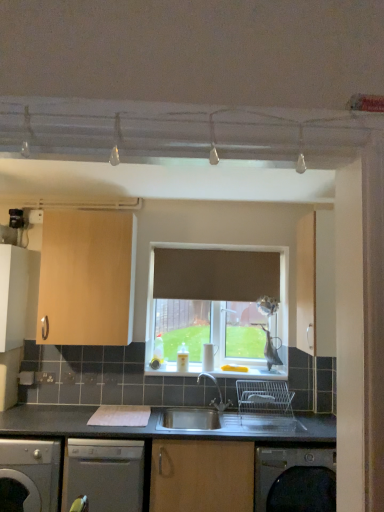
You are a GUI agent. You are given a task and a screenshot of the screen. Output one action in this format:
    pyautogui.click(x=<x>, y=<y>)
    Task: Click on the satin silver dishwasher at lower center, the second dishwasher viewed from the left
    The width and height of the screenshot is (384, 512).
    Given the screenshot: What is the action you would take?
    tap(104, 474)

You are a GUI agent. You are given a task and a screenshot of the screen. Output one action in this format:
    pyautogui.click(x=<x>, y=<y>)
    Task: Click on the stainless steel sink at center
    
    Given the screenshot: What is the action you would take?
    pyautogui.click(x=239, y=411)

What do you see at coordinates (239, 411) in the screenshot? I see `stainless steel sink at center` at bounding box center [239, 411].

Measure the distance between matte wood cabinet at right, the 1th cabinetry positioned from the right, and camera.

A distance of 7.50 feet exists between matte wood cabinet at right, the 1th cabinetry positioned from the right, and camera.

Where is `white glossy window sill at center`? The image size is (384, 512). white glossy window sill at center is located at coordinates coord(252,372).

The width and height of the screenshot is (384, 512). Find the location of `satin silver dishwasher at lower center, the second dishwasher viewed from the left`. satin silver dishwasher at lower center, the second dishwasher viewed from the left is located at coordinates (104, 474).

From the image's perspective, would you say stainless steel sink at center is positioned over white glossy window sill at center?

No, from the image's perspective, stainless steel sink at center is not above white glossy window sill at center.

From a real-world perspective, is stainless steel sink at center physically located above or below white glossy window sill at center?

From a real-world perspective, stainless steel sink at center is physically below white glossy window sill at center.

Locate an element on the screen. The height and width of the screenshot is (512, 384). sink below the white glossy window sill at center (from the image's perspective) is located at coordinates (239, 411).

Is stainless steel sink at center oriented towards white glossy window sill at center?

No, stainless steel sink at center is not aimed at white glossy window sill at center.

Is white matte cabinet at left, which appears as the 1th cabinetry when viewed from the left, oriented away from matte wood cabinet at right, arranged as the third cabinetry when viewed from the left?

No, white matte cabinet at left, which appears as the 1th cabinetry when viewed from the left,'s orientation is not away from matte wood cabinet at right, arranged as the third cabinetry when viewed from the left.

Looking at this image, which object is wider, white matte cabinet at left, which appears as the 1th cabinetry when viewed from the left, or matte wood cabinet at right, the 1th cabinetry positioned from the right?

With larger width is matte wood cabinet at right, the 1th cabinetry positioned from the right.

Which is in front, white matte cabinet at left, marked as the third cabinetry in a right-to-left arrangement, or matte wood cabinet at right, arranged as the third cabinetry when viewed from the left?

matte wood cabinet at right, arranged as the third cabinetry when viewed from the left, is more forward.

In terms of height, does white matte cabinet at left, marked as the third cabinetry in a right-to-left arrangement, look taller or shorter compared to matte wood cabinet at right, arranged as the third cabinetry when viewed from the left?

Clearly, white matte cabinet at left, marked as the third cabinetry in a right-to-left arrangement, is shorter compared to matte wood cabinet at right, arranged as the third cabinetry when viewed from the left.

Which is behind, matte wood cabinet at right, arranged as the third cabinetry when viewed from the left, or white matte cabinet at left, marked as the third cabinetry in a right-to-left arrangement?

white matte cabinet at left, marked as the third cabinetry in a right-to-left arrangement, is behind.

From the image's perspective, is matte wood cabinet at right, arranged as the third cabinetry when viewed from the left, beneath white matte cabinet at left, which appears as the 1th cabinetry when viewed from the left?

No, from the image's perspective, matte wood cabinet at right, arranged as the third cabinetry when viewed from the left, is not below white matte cabinet at left, which appears as the 1th cabinetry when viewed from the left.

Between matte wood cabinet at right, the 1th cabinetry positioned from the right, and white matte cabinet at left, marked as the third cabinetry in a right-to-left arrangement, which one has smaller size?

white matte cabinet at left, marked as the third cabinetry in a right-to-left arrangement.

Is matte wood cabinet at right, the 1th cabinetry positioned from the right, looking in the opposite direction of white matte cabinet at left, marked as the third cabinetry in a right-to-left arrangement?

Result: matte wood cabinet at right, the 1th cabinetry positioned from the right, does not have its back to white matte cabinet at left, marked as the third cabinetry in a right-to-left arrangement.

Between white matte cabinet at left, marked as the third cabinetry in a right-to-left arrangement, and satin silver dishwasher at lower center, acting as the first dishwasher starting from the right, which one has smaller width?

With smaller width is white matte cabinet at left, marked as the third cabinetry in a right-to-left arrangement.

How far apart are white matte cabinet at left, marked as the third cabinetry in a right-to-left arrangement, and satin silver dishwasher at lower center, the second dishwasher viewed from the left?

white matte cabinet at left, marked as the third cabinetry in a right-to-left arrangement, and satin silver dishwasher at lower center, the second dishwasher viewed from the left, are 3.48 feet apart.

From the image's perspective, which cabinetry is the 1st one above the satin silver dishwasher at lower center, acting as the first dishwasher starting from the right? Please provide its 2D coordinates.

[(13, 295)]

From a real-world perspective, is white matte cabinet at left, which appears as the 1th cabinetry when viewed from the left, located beneath satin silver dishwasher at lower center, the second dishwasher viewed from the left?

Actually, white matte cabinet at left, which appears as the 1th cabinetry when viewed from the left, is physically above satin silver dishwasher at lower center, the second dishwasher viewed from the left, in the real world.

Which is more to the left, stainless steel sink at center or white matte cabinet at left, marked as the third cabinetry in a right-to-left arrangement?

white matte cabinet at left, marked as the third cabinetry in a right-to-left arrangement.

Is stainless steel sink at center wider than white matte cabinet at left, marked as the third cabinetry in a right-to-left arrangement?

Yes, stainless steel sink at center is wider than white matte cabinet at left, marked as the third cabinetry in a right-to-left arrangement.

Is there a large distance between stainless steel sink at center and white matte cabinet at left, marked as the third cabinetry in a right-to-left arrangement?

stainless steel sink at center is far away from white matte cabinet at left, marked as the third cabinetry in a right-to-left arrangement.

From the image's perspective, is satin silver dishwasher at lower left, the first dishwasher viewed from the left, beneath white matte cabinet at left, marked as the third cabinetry in a right-to-left arrangement?

Indeed, from the image's perspective, satin silver dishwasher at lower left, the first dishwasher viewed from the left, is shown beneath white matte cabinet at left, marked as the third cabinetry in a right-to-left arrangement.

Considering the sizes of objects satin silver dishwasher at lower left, the first dishwasher viewed from the left, and white matte cabinet at left, which appears as the 1th cabinetry when viewed from the left, in the image provided, who is smaller, satin silver dishwasher at lower left, the first dishwasher viewed from the left, or white matte cabinet at left, which appears as the 1th cabinetry when viewed from the left,?

white matte cabinet at left, which appears as the 1th cabinetry when viewed from the left.

Is the position of satin silver dishwasher at lower left, the 2th dishwasher in the right-to-left sequence, more distant than that of white matte cabinet at left, which appears as the 1th cabinetry when viewed from the left?

No, satin silver dishwasher at lower left, the 2th dishwasher in the right-to-left sequence, is in front of white matte cabinet at left, which appears as the 1th cabinetry when viewed from the left.

In the scene shown: Considering the positions of objects satin silver dishwasher at lower center, acting as the first dishwasher starting from the right, and stainless steel sink at center in the image provided, who is in front, satin silver dishwasher at lower center, acting as the first dishwasher starting from the right, or stainless steel sink at center?

satin silver dishwasher at lower center, acting as the first dishwasher starting from the right, is more forward.

Is stainless steel sink at center located within satin silver dishwasher at lower center, acting as the first dishwasher starting from the right?

No, satin silver dishwasher at lower center, acting as the first dishwasher starting from the right, does not contain stainless steel sink at center.

Can you confirm if satin silver dishwasher at lower center, the second dishwasher viewed from the left, is thinner than stainless steel sink at center?

In fact, satin silver dishwasher at lower center, the second dishwasher viewed from the left, might be wider than stainless steel sink at center.

You are a GUI agent. You are given a task and a screenshot of the screen. Output one action in this format:
    pyautogui.click(x=<x>, y=<y>)
    Task: Click on the sink that appears below the white glossy window sill at center (from a real-world perspective)
    Image resolution: width=384 pixels, height=512 pixels.
    Given the screenshot: What is the action you would take?
    pyautogui.click(x=239, y=411)

The height and width of the screenshot is (512, 384). I want to click on cabinetry located below the matte wood cabinet at right, the 1th cabinetry positioned from the right (from the image's perspective), so click(13, 295).

From the image, which object appears to be farther from satin silver dishwasher at lower left, the 2th dishwasher in the right-to-left sequence, satin silver dishwasher at lower center, the second dishwasher viewed from the left, or white matte cabinet at left, marked as the third cabinetry in a right-to-left arrangement?

Based on the image, white matte cabinet at left, marked as the third cabinetry in a right-to-left arrangement, appears to be further to satin silver dishwasher at lower left, the 2th dishwasher in the right-to-left sequence.

Which object lies nearer to the anchor point satin silver dishwasher at lower center, acting as the first dishwasher starting from the right, white matte cabinet at left, marked as the third cabinetry in a right-to-left arrangement, or stainless steel sink at center?

Based on the image, stainless steel sink at center appears to be nearer to satin silver dishwasher at lower center, acting as the first dishwasher starting from the right.

From the image, which object appears to be nearer to satin silver dishwasher at lower left, the first dishwasher viewed from the left, white matte cabinet at left, which appears as the 1th cabinetry when viewed from the left, or white glossy window sill at center?

white matte cabinet at left, which appears as the 1th cabinetry when viewed from the left, is positioned closer to the anchor satin silver dishwasher at lower left, the first dishwasher viewed from the left.

Considering their positions, is white matte cabinet at left, marked as the third cabinetry in a right-to-left arrangement, positioned closer to stainless steel sink at center than matte wood cabinet at right, the 1th cabinetry positioned from the right?

matte wood cabinet at right, the 1th cabinetry positioned from the right, is positioned closer to the anchor stainless steel sink at center.

From the image, which object appears to be nearer to satin silver dishwasher at lower left, the 2th dishwasher in the right-to-left sequence, satin silver dishwasher at lower center, acting as the first dishwasher starting from the right, or light wood cabinet at upper left, which is the 2th cabinetry in right-to-left order?

Among the two, satin silver dishwasher at lower center, acting as the first dishwasher starting from the right, is located nearer to satin silver dishwasher at lower left, the 2th dishwasher in the right-to-left sequence.

Estimate the real-world distances between objects in this image. Which object is further from satin silver dishwasher at lower left, the first dishwasher viewed from the left, stainless steel sink at center or matte wood cabinet at right, arranged as the third cabinetry when viewed from the left?

matte wood cabinet at right, arranged as the third cabinetry when viewed from the left, is further to satin silver dishwasher at lower left, the first dishwasher viewed from the left.

Which object lies further to the anchor point satin silver dishwasher at lower center, the second dishwasher viewed from the left, light wood cabinet at upper left, which appears as the second cabinetry when viewed from the left, or white matte cabinet at left, marked as the third cabinetry in a right-to-left arrangement?

white matte cabinet at left, marked as the third cabinetry in a right-to-left arrangement, lies further to satin silver dishwasher at lower center, the second dishwasher viewed from the left, than the other object.

Based on the photo, which object lies nearer to the anchor point white glossy window sill at center, satin silver dishwasher at lower left, the first dishwasher viewed from the left, or white matte cabinet at left, marked as the third cabinetry in a right-to-left arrangement?

satin silver dishwasher at lower left, the first dishwasher viewed from the left.

Where is `dishwasher situated between satin silver dishwasher at lower left, the 2th dishwasher in the right-to-left sequence, and matte wood cabinet at right, arranged as the third cabinetry when viewed from the left, from left to right`? dishwasher situated between satin silver dishwasher at lower left, the 2th dishwasher in the right-to-left sequence, and matte wood cabinet at right, arranged as the third cabinetry when viewed from the left, from left to right is located at coordinates (104, 474).

Locate an element on the screen. This screenshot has height=512, width=384. sink that lies between light wood cabinet at upper left, which is the 2th cabinetry in right-to-left order, and satin silver dishwasher at lower center, the second dishwasher viewed from the left, from top to bottom is located at coordinates (239, 411).

Find the location of a particular element. window sill between satin silver dishwasher at lower left, the 2th dishwasher in the right-to-left sequence, and matte wood cabinet at right, the 1th cabinetry positioned from the right, in the horizontal direction is located at coordinates (252, 372).

Identify the location of cabinetry between white matte cabinet at left, which appears as the 1th cabinetry when viewed from the left, and matte wood cabinet at right, the 1th cabinetry positioned from the right, from left to right. The height and width of the screenshot is (512, 384). (87, 278).